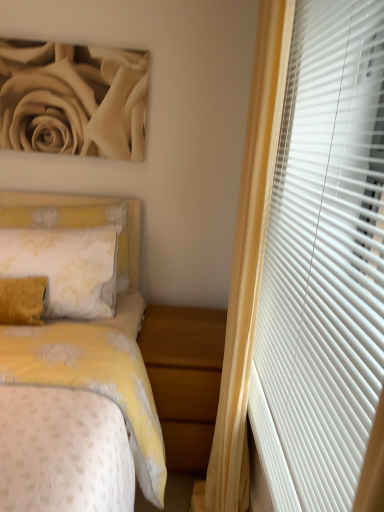
Question: From the image's perspective, is wooden nightstand at lower center on white matte blinds at right?

Choices:
 (A) yes
 (B) no

Answer: (B)

Question: Is wooden nightstand at lower center positioned in front of white matte blinds at right?

Choices:
 (A) no
 (B) yes

Answer: (A)

Question: Is wooden nightstand at lower center next to white matte blinds at right and touching it?

Choices:
 (A) yes
 (B) no

Answer: (B)

Question: Is wooden nightstand at lower center not close to white matte blinds at right?

Choices:
 (A) no
 (B) yes

Answer: (A)

Question: Can you confirm if wooden nightstand at lower center is taller than white matte blinds at right?

Choices:
 (A) no
 (B) yes

Answer: (A)

Question: From a real-world perspective, is wooden nightstand at lower center under white matte blinds at right?

Choices:
 (A) no
 (B) yes

Answer: (B)

Question: From the image's perspective, is wooden nightstand at lower center located above yellow fabric headboard at left?

Choices:
 (A) yes
 (B) no

Answer: (B)

Question: Does wooden nightstand at lower center lie in front of yellow fabric headboard at left?

Choices:
 (A) yes
 (B) no

Answer: (A)

Question: Is wooden nightstand at lower center oriented towards yellow fabric headboard at left?

Choices:
 (A) yes
 (B) no

Answer: (B)

Question: From the image's perspective, is wooden nightstand at lower center beneath yellow fabric headboard at left?

Choices:
 (A) yes
 (B) no

Answer: (A)

Question: Is wooden nightstand at lower center completely or partially outside of yellow fabric headboard at left?

Choices:
 (A) yes
 (B) no

Answer: (A)

Question: Does wooden nightstand at lower center have a greater height compared to yellow fabric headboard at left?

Choices:
 (A) no
 (B) yes

Answer: (B)

Question: From the image's perspective, does white matte blinds at right appear lower than wooden nightstand at lower center?

Choices:
 (A) yes
 (B) no

Answer: (B)